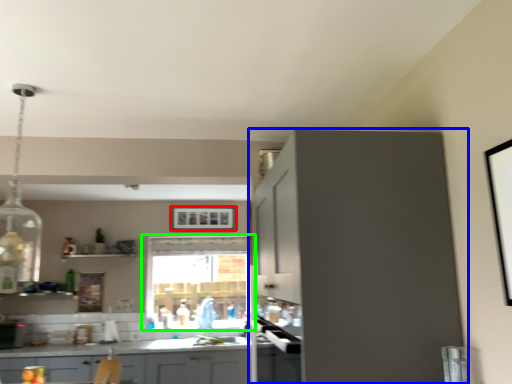
Question: Estimate the real-world distances between objects in this image. Which object is closer to picture frame (highlighted by a red box), cabinetry (highlighted by a blue box) or window (highlighted by a green box)?

Choices:
 (A) cabinetry
 (B) window

Answer: (B)